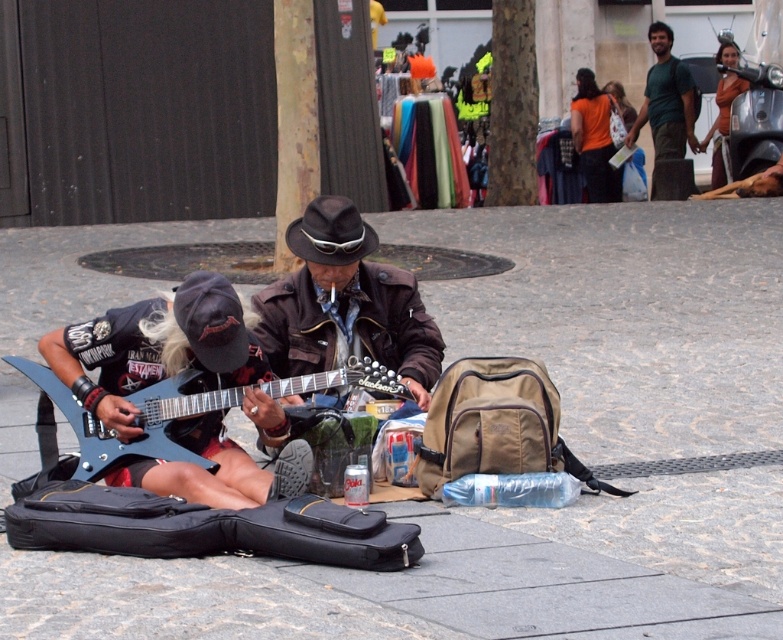
In the scene shown: You are a photographer standing at a certain distance from the scene. You want to capture a closeup shot of the brown felt hat at center. Based on the given information, is the current distance suitable for a closeup?

The brown felt hat at center is 9.73 meters away from the camera. A closeup typically requires a much closer distance, so the current distance of 9.73 meters is not suitable for a closeup.

You are standing in front of the street performers and want to take a photo. You notice two points marked in the scene. Which point, point [349,212] or point [569,120], would appear larger in your camera view?

Point [349,212] is closer to the camera than point [569,120], so it would appear larger in the camera view.